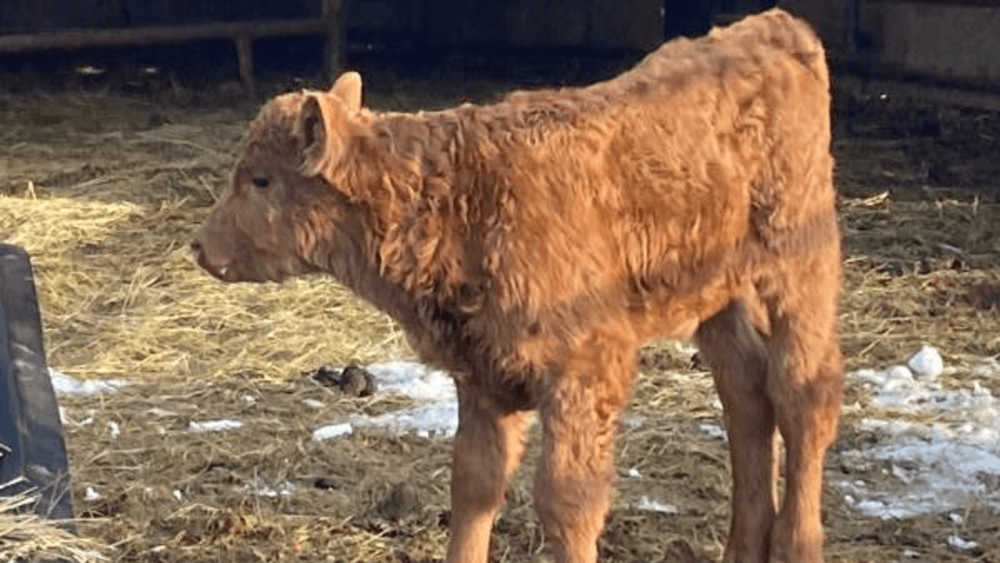
This screenshot has height=563, width=1000. What are the coordinates of `wall of enclosure` in the screenshot? It's located at (x=939, y=58).